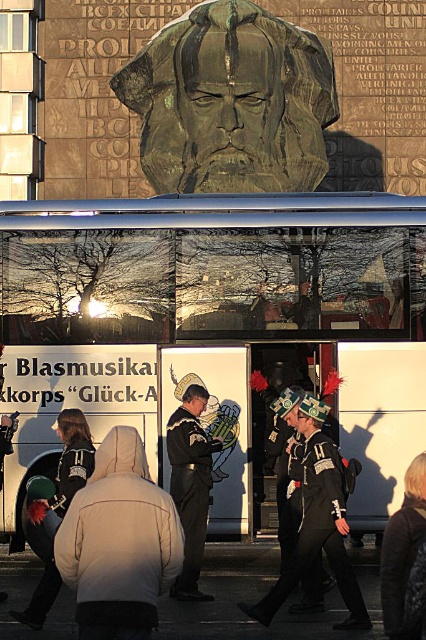
You are a costume designer preparing for a historical play. You have two props in front of you, the black leather uniform at center and the brushed metal helmet at lower left. Which prop requires a larger storage space?

The black leather uniform at center requires a larger storage space because it is bigger than the brushed metal helmet at lower left.

You are a photographer standing at the scene. You want to take a photo that includes both the white matte jacket at lower left and the brushed metal helmet at lower left. The minimum distance between them is 18 feet. Do you think you can capture both in one frame without moving your position?

The white matte jacket at lower left is 17.96 feet away from the brushed metal helmet at lower left. Since the minimum distance between them is just under 18 feet, you can capture both in one frame without moving your position.